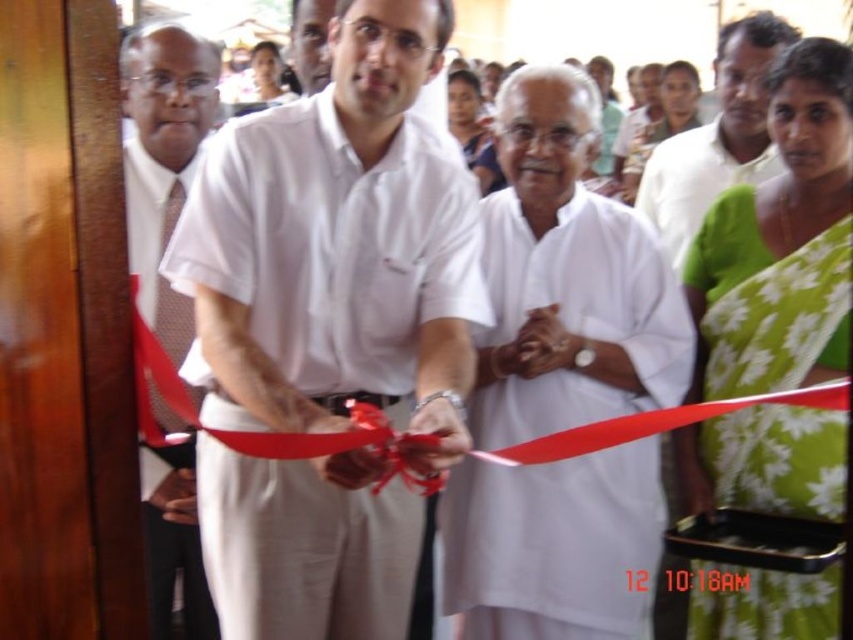
Question: Does white cotton shirt at center have a greater width compared to smooth skin face at upper center?

Choices:
 (A) yes
 (B) no

Answer: (B)

Question: Which point is closer to the camera?

Choices:
 (A) matte brown tie at left
 (B) green floral saree at center
 (C) green floral sari at upper right

Answer: (A)

Question: Where is green floral sari at upper right located in relation to green floral saree at center in the image?

Choices:
 (A) left
 (B) right

Answer: (B)

Question: Among these points, which one is farthest from the camera?

Choices:
 (A) (631, 147)
 (B) (621, 579)
 (C) (296, 392)

Answer: (A)

Question: Can you confirm if white cotton kurta at center is smaller than green floral saree at center?

Choices:
 (A) yes
 (B) no

Answer: (A)

Question: Which object is farther from the camera taking this photo?

Choices:
 (A) white smooth shirt at center
 (B) green floral sari at upper right
 (C) white cotton kurta at center

Answer: (B)